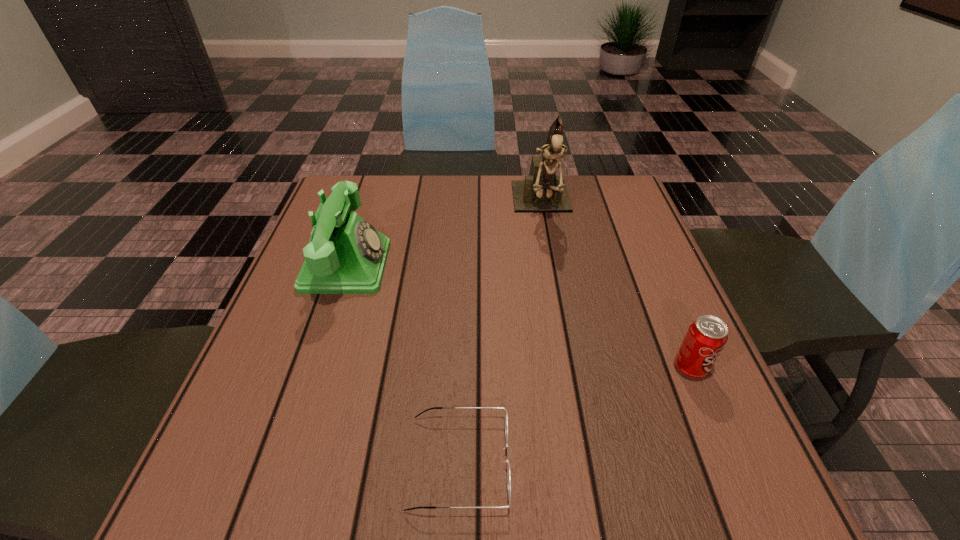
Find the location of a particular element. Image resolution: width=960 pixels, height=540 pixels. the tallest object is located at coordinates (542, 190).

Identify the location of figurine. (x=542, y=190).

The image size is (960, 540). I want to click on the leftmost object, so click(x=346, y=255).

The image size is (960, 540). I want to click on the second tallest object, so click(346, 255).

This screenshot has width=960, height=540. I want to click on the third tallest object, so click(706, 337).

Find the location of a particular element. Image resolution: width=960 pixels, height=540 pixels. soda is located at coordinates (706, 337).

The width and height of the screenshot is (960, 540). Find the location of `the shortest object`. the shortest object is located at coordinates (503, 408).

Identify the location of spectacles. The width and height of the screenshot is (960, 540). (503, 408).

Identify the location of free space located 0.300m on the front-facing side of the tallest object. The image size is (960, 540). (564, 325).

Locate an element on the screen. Image resolution: width=960 pixels, height=540 pixels. vacant region located 0.070m on the dial of the telephone is located at coordinates (418, 266).